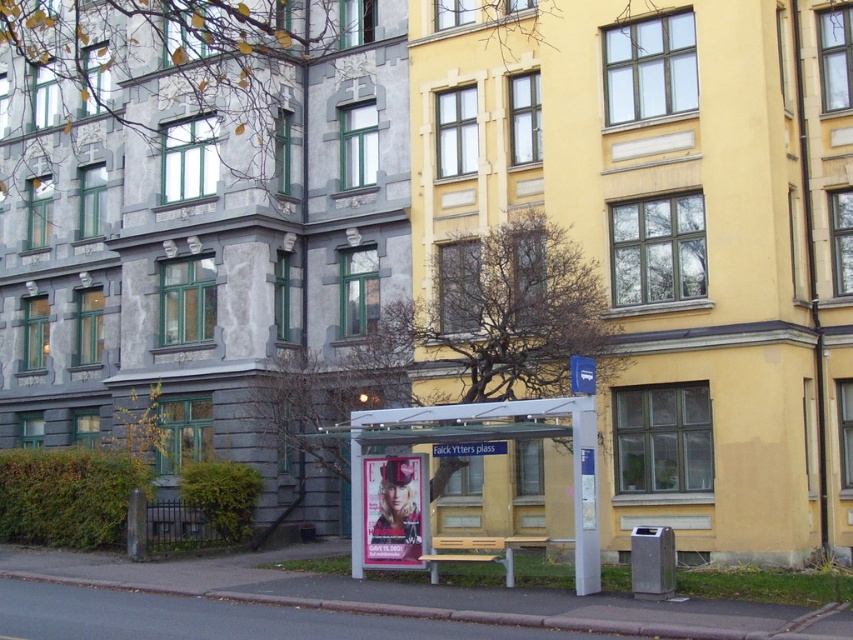
Question: Which object is closer to the camera taking this photo?

Choices:
 (A) metallic silver bus stop at center
 (B) blue plastic bus stop sign at center
 (C) matte plastic poster at center

Answer: (A)

Question: In this image, where is matte plastic poster at center located relative to blue plastic bus stop sign at center?

Choices:
 (A) below
 (B) above

Answer: (A)

Question: Which point is farther to the camera?

Choices:
 (A) blue plastic bus stop sign at center
 (B) metallic silver bus stop at center

Answer: (A)

Question: In this image, where is metallic silver bus stop at center located relative to blue plastic bus stop sign at center?

Choices:
 (A) right
 (B) left

Answer: (B)

Question: Is matte plastic poster at center wider than blue plastic bus stop sign at center?

Choices:
 (A) yes
 (B) no

Answer: (A)

Question: Among these points, which one is nearest to the camera?

Choices:
 (A) click(x=585, y=356)
 (B) click(x=428, y=536)
 (C) click(x=407, y=524)

Answer: (B)